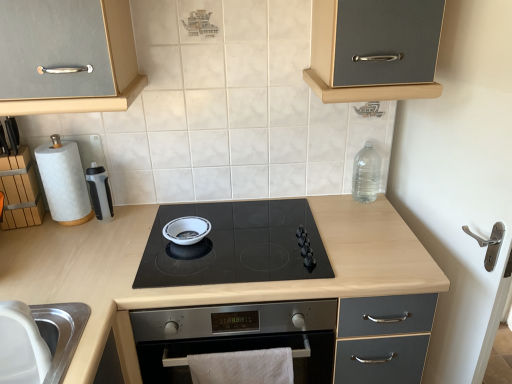
Image resolution: width=512 pixels, height=384 pixels. What are the coordinates of `free spot in front of white paper towel at left` in the screenshot? It's located at (57, 250).